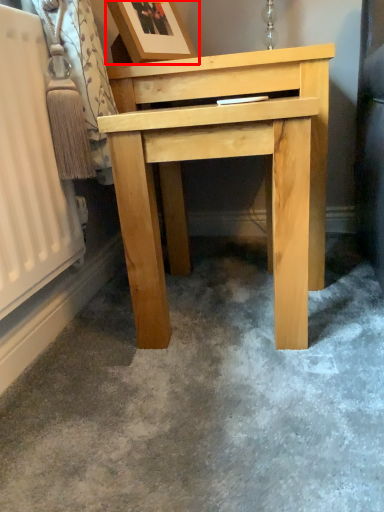
Question: Observing the image, what is the correct spatial positioning of picture frame (annotated by the red box) in reference to table?

Choices:
 (A) left
 (B) right

Answer: (A)